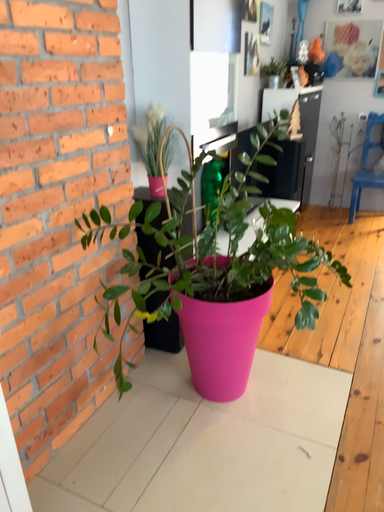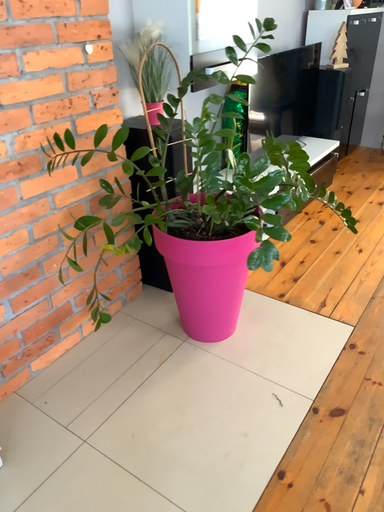
Question: Which way did the camera rotate in the video?

Choices:
 (A) rotated downward
 (B) rotated upward

Answer: (A)